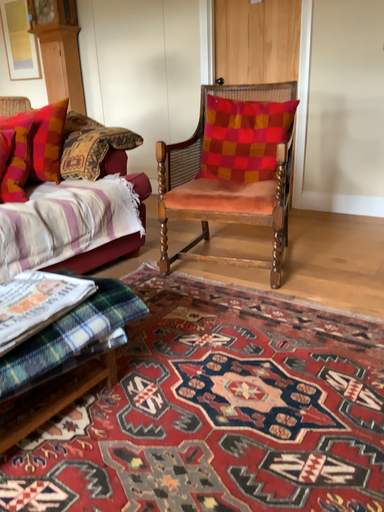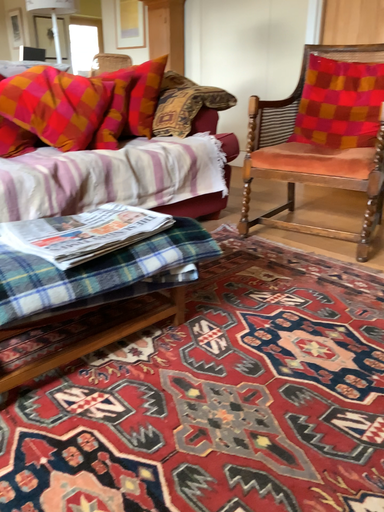
Question: Which way did the camera rotate in the video?

Choices:
 (A) rotated left
 (B) rotated right

Answer: (A)